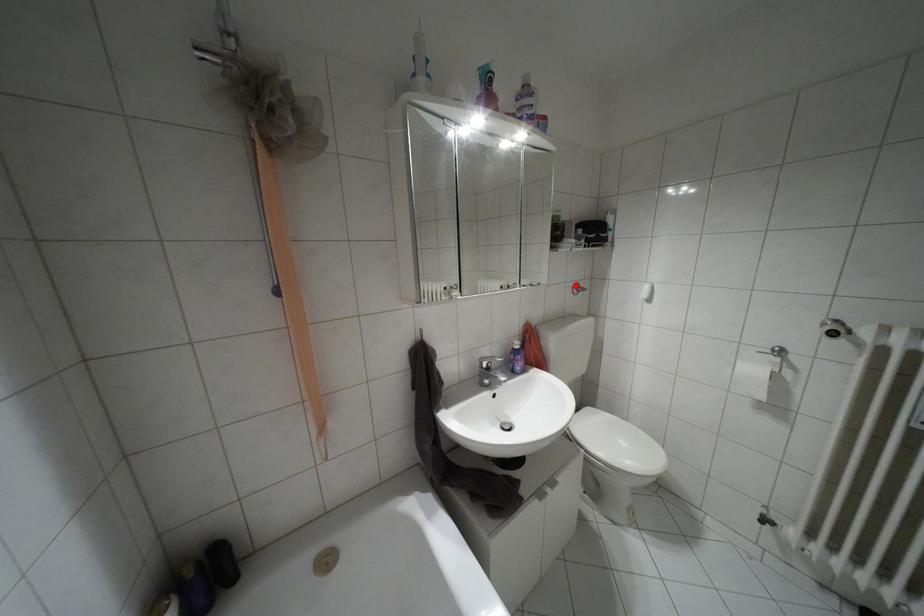
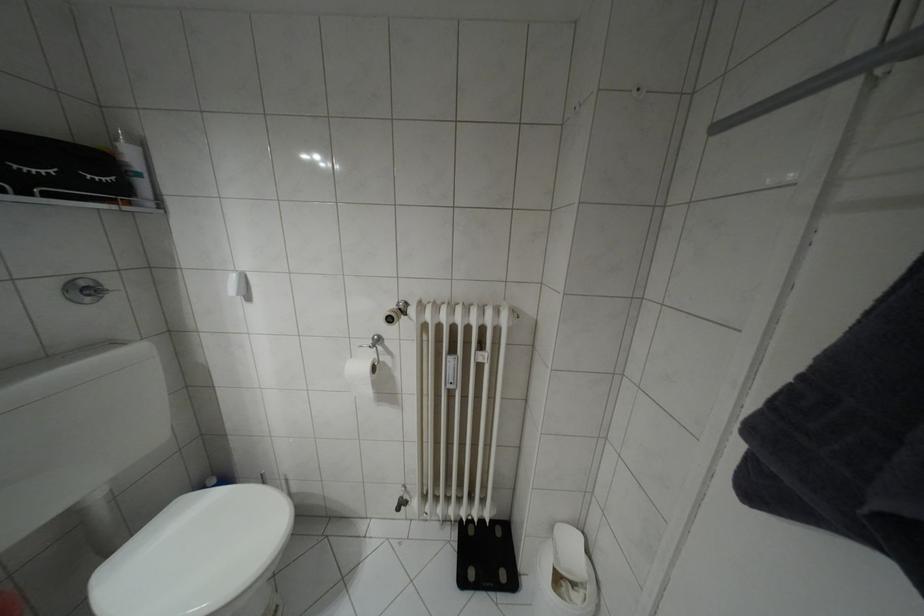
Locate, in the second image, the point that corresponds to the highlighted location in the first image.

(81, 284)